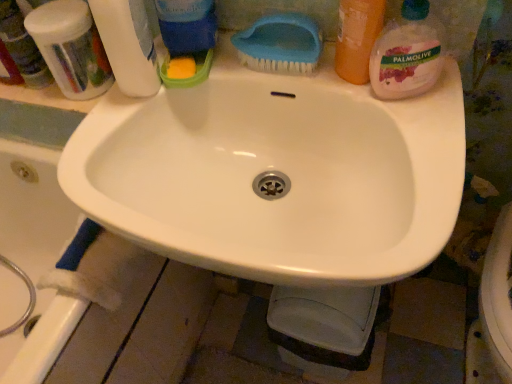
Question: Is translucent plastic toothbrushes at upper left facing towards white glossy sink at center?

Choices:
 (A) yes
 (B) no

Answer: (B)

Question: Could white glossy sink at center be considered to be inside translucent plastic toothbrushes at upper left?

Choices:
 (A) yes
 (B) no

Answer: (B)

Question: Does translucent plastic toothbrushes at upper left touch white glossy sink at center?

Choices:
 (A) no
 (B) yes

Answer: (A)

Question: Considering the relative sizes of translucent plastic toothbrushes at upper left and white glossy sink at center in the image provided, is translucent plastic toothbrushes at upper left smaller than white glossy sink at center?

Choices:
 (A) no
 (B) yes

Answer: (B)

Question: Does translucent plastic toothbrushes at upper left appear on the left side of white glossy sink at center?

Choices:
 (A) no
 (B) yes

Answer: (B)

Question: Does point (79, 77) appear closer or farther from the camera than point (94, 14)?

Choices:
 (A) closer
 (B) farther

Answer: (B)

Question: Is translucent plastic toothbrushes at upper left bigger or smaller than white plastic bottle at upper left, the 1th cleaning product from the left?

Choices:
 (A) small
 (B) big

Answer: (B)

Question: Would you say translucent plastic toothbrushes at upper left is inside or outside white plastic bottle at upper left, the 1th cleaning product from the left?

Choices:
 (A) inside
 (B) outside

Answer: (B)

Question: From the image's perspective, is translucent plastic toothbrushes at upper left above or below white plastic bottle at upper left, the 1th cleaning product from the left?

Choices:
 (A) above
 (B) below

Answer: (A)

Question: From a real-world perspective, is translucent orange soap at upper right, placed as the second cleaning product when sorted from right to left, positioned above or below palmolive liquid soap at upper right, which appears as the first cleaning product when viewed from the right?

Choices:
 (A) below
 (B) above

Answer: (B)

Question: Would you say translucent orange soap at upper right, placed as the second cleaning product when sorted from right to left, is to the left or to the right of palmolive liquid soap at upper right, the fourth cleaning product viewed from the left, in the picture?

Choices:
 (A) right
 (B) left

Answer: (B)

Question: Is translucent orange soap at upper right, which ranks as the 3th cleaning product in left-to-right order, inside or outside of palmolive liquid soap at upper right, which appears as the first cleaning product when viewed from the right?

Choices:
 (A) outside
 (B) inside

Answer: (A)

Question: From their relative heights in the image, would you say translucent orange soap at upper right, placed as the second cleaning product when sorted from right to left, is taller or shorter than palmolive liquid soap at upper right, which appears as the first cleaning product when viewed from the right?

Choices:
 (A) tall
 (B) short

Answer: (A)

Question: Considering the relative positions of translucent orange soap at upper right, which ranks as the 3th cleaning product in left-to-right order, and blue plastic brush at upper center in the image provided, is translucent orange soap at upper right, which ranks as the 3th cleaning product in left-to-right order, to the left or to the right of blue plastic brush at upper center?

Choices:
 (A) right
 (B) left

Answer: (A)

Question: Considering the positions of point tap(355, 77) and point tap(281, 21), is point tap(355, 77) closer or farther from the camera than point tap(281, 21)?

Choices:
 (A) closer
 (B) farther

Answer: (A)